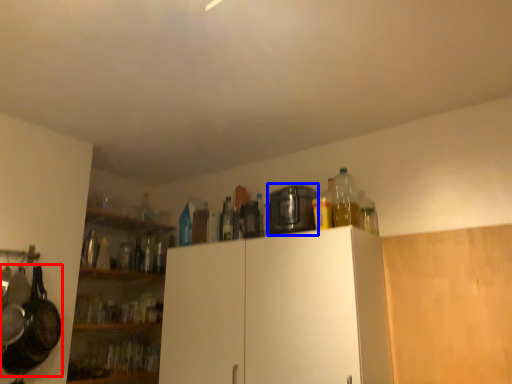
Question: Which of the following is the closest to the observer, frying pan (highlighted by a red box) or appliance (highlighted by a blue box)?

Choices:
 (A) frying pan
 (B) appliance

Answer: (A)